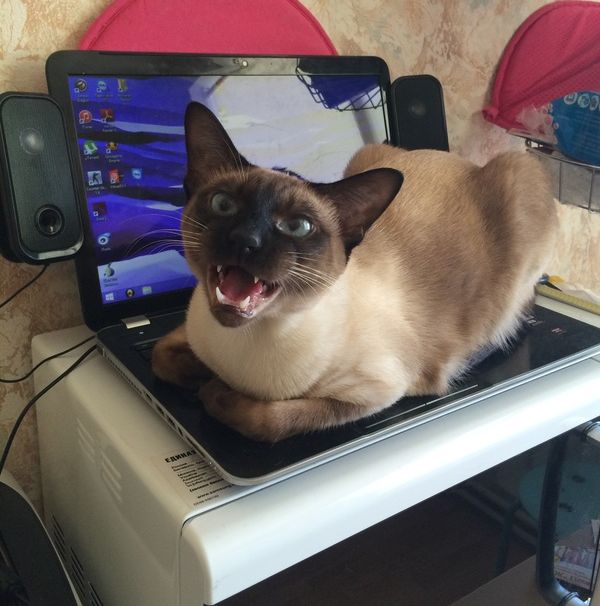
The image size is (600, 606). In order to click on shelf in this screenshot , I will do `click(541, 137)`.